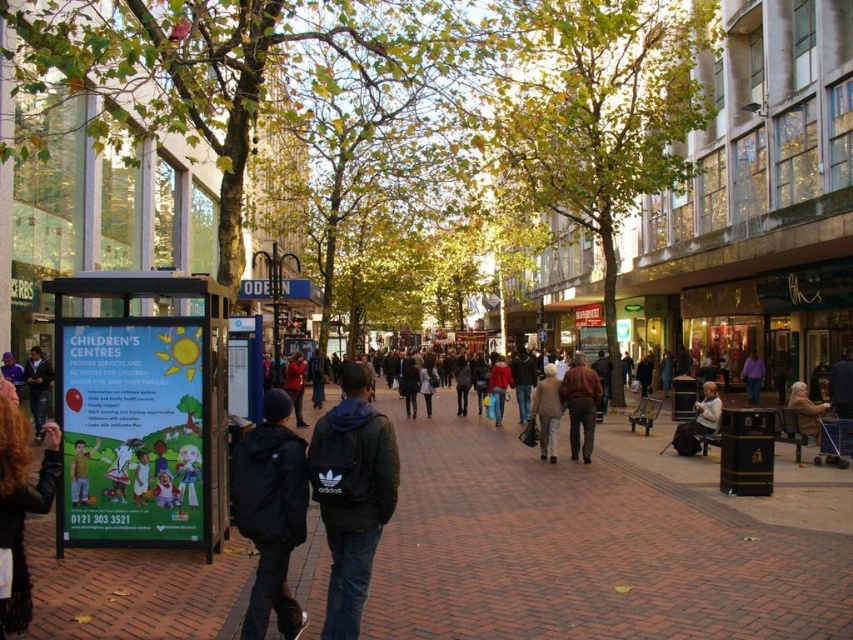
Question: Can you confirm if black adidas backpack at center is positioned below red matte jacket at center?

Choices:
 (A) yes
 (B) no

Answer: (B)

Question: Is brick pavement at center thinner than light beige fabric jacket at lower right?

Choices:
 (A) no
 (B) yes

Answer: (A)

Question: Can you confirm if black adidas backpack at lower left is bigger than light beige fabric coat at center?

Choices:
 (A) no
 (B) yes

Answer: (B)

Question: Which of these objects is positioned closest to the black adidas backpack at lower left?

Choices:
 (A) black adidas backpack at center
 (B) red matte jacket at center

Answer: (A)

Question: Which point is closer to the camera?

Choices:
 (A) black adidas backpack at center
 (B) light beige fabric jacket at lower right
 (C) brick pavement at center

Answer: (C)

Question: Which point is farther to the camera?

Choices:
 (A) light beige fabric coat at center
 (B) black adidas backpack at lower left
 (C) black adidas backpack at center
 (D) light beige fabric jacket at lower right

Answer: (A)